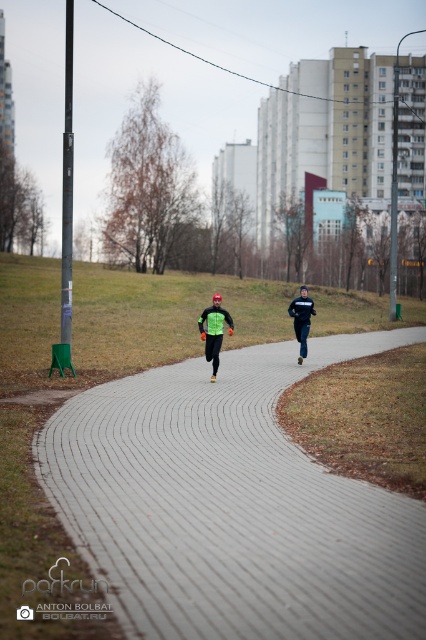
Can you confirm if neon green fabric at center is positioned above black matte running suit at center?

Incorrect, neon green fabric at center is not positioned above black matte running suit at center.

Which is more to the right, neon green fabric at center or black matte running suit at center?

black matte running suit at center

Between point (204, 333) and point (304, 288), which one is positioned in front?

Point (204, 333) is more forward.

Locate an element on the screen. Image resolution: width=426 pixels, height=640 pixels. neon green fabric at center is located at coordinates (213, 330).

Is gray brick pavement at center shorter than neon green fabric at center?

Correct, gray brick pavement at center is not as tall as neon green fabric at center.

Measure the distance between gray brick pavement at center and neon green fabric at center.

The distance of gray brick pavement at center from neon green fabric at center is 3.52 meters.

Does point (359, 516) come farther from viewer compared to point (215, 305)?

No, it is in front of (215, 305).

At what (x,y) coordinates should I click in order to perform the action: click on gray brick pavement at center. Please return your answer as a coordinate pair (x, y). The width and height of the screenshot is (426, 640). Looking at the image, I should click on (230, 506).

Who is shorter, gray brick pavement at center or black matte running suit at center?

gray brick pavement at center

Is point (101, 440) more distant than point (305, 344)?

No, (101, 440) is closer to viewer.

Is point (89, 458) farther from viewer compared to point (307, 307)?

No, it is not.

Locate an element on the screen. gray brick pavement at center is located at coordinates (230, 506).